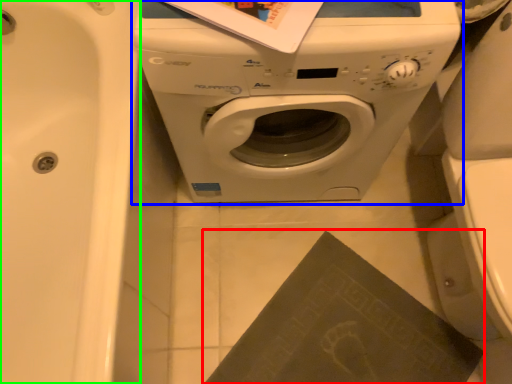
Question: Estimate the real-world distances between objects in this image. Which object is closer to paperback book (highlighted by a red box), washing machine (highlighted by a blue box) or bath (highlighted by a green box)?

Choices:
 (A) washing machine
 (B) bath

Answer: (A)